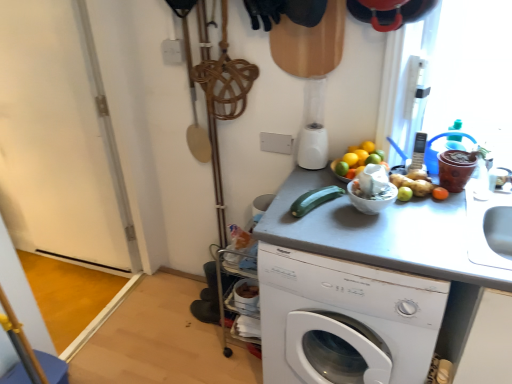
Find the location of a particular element. The width and height of the screenshot is (512, 384). free space between white glossy bowl at upper right and green matte cucumber at center is located at coordinates (347, 221).